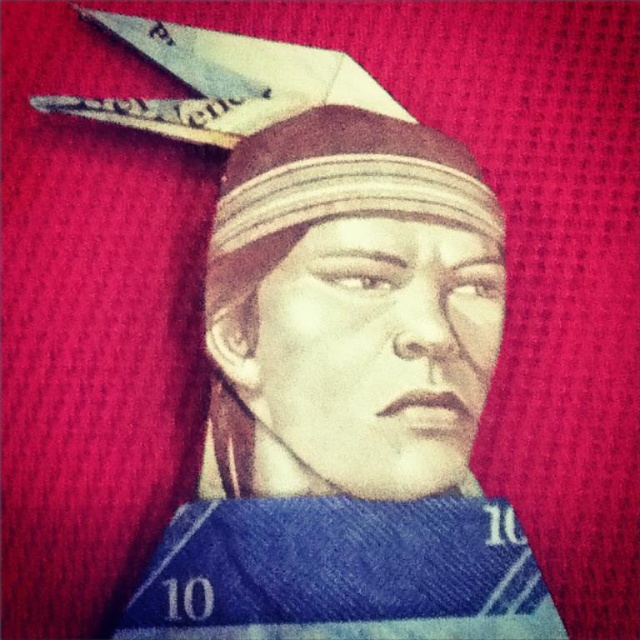
Question: Does smooth paper head at center have a smaller size compared to metallic silver scissors at upper center?

Choices:
 (A) yes
 (B) no

Answer: (B)

Question: Which of the following is the farthest from the observer?

Choices:
 (A) (42, 97)
 (B) (324, 163)

Answer: (A)

Question: From the image, what is the correct spatial relationship of smooth paper head at center in relation to metallic silver scissors at upper center?

Choices:
 (A) right
 (B) left

Answer: (A)

Question: In this image, where is smooth paper head at center located relative to metallic silver scissors at upper center?

Choices:
 (A) above
 (B) below

Answer: (B)

Question: Which point appears farthest from the camera in this image?

Choices:
 (A) (77, 13)
 (B) (376, 200)

Answer: (A)